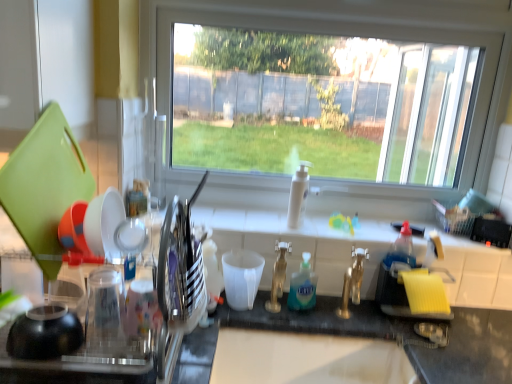
Question: Considering the positions of white matte measuring cup at center, the 1th tableware in the right-to-left sequence, and transparent glass window at center in the image, is white matte measuring cup at center, the 1th tableware in the right-to-left sequence, bigger or smaller than transparent glass window at center?

Choices:
 (A) small
 (B) big

Answer: (A)

Question: Is point (234, 281) closer or farther from the camera than point (422, 46)?

Choices:
 (A) closer
 (B) farther

Answer: (A)

Question: Considering the real-world distances, which object is closest to the shiny silver utensil holder at left, the second tableware when ordered from right to left?

Choices:
 (A) gold metallic faucet at center
 (B) transparent glass window at center
 (C) blue translucent liquid soap at center
 (D) clear plastic dish rack at left
 (E) white glossy soap dispenser at center

Answer: (D)

Question: Considering the real-world distances, which object is farthest from the white matte measuring cup at center, the 1th tableware in the right-to-left sequence?

Choices:
 (A) gold metallic faucet at center
 (B) shiny silver utensil holder at left, the second tableware viewed from the left
 (C) gold metallic faucet at center
 (D) white glossy soap dispenser at center
 (E) clear plastic dish rack at left

Answer: (E)